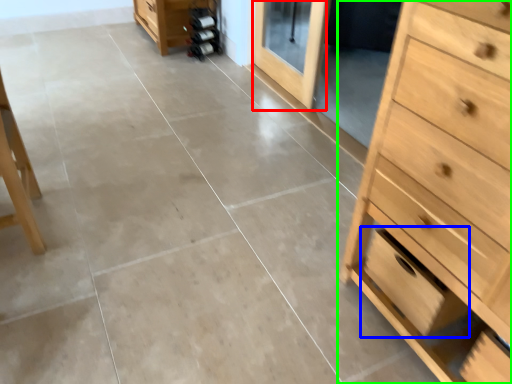
Question: Which object is the closest to the screen door (highlighted by a red box)? Choose among these: drawer (highlighted by a blue box) or chest of drawers (highlighted by a green box).

Choices:
 (A) drawer
 (B) chest of drawers

Answer: (A)